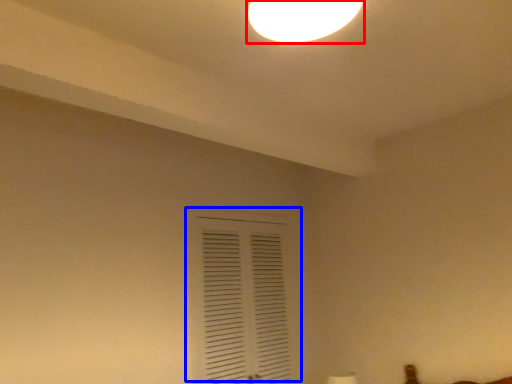
Question: Which object appears farthest to the camera in this image, lamp (highlighted by a red box) or window (highlighted by a blue box)?

Choices:
 (A) lamp
 (B) window

Answer: (B)